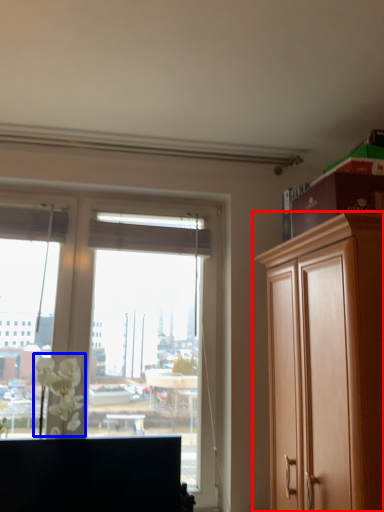
Question: Which of the following is the farthest to the observer, cabinetry (highlighted by a red box) or flower (highlighted by a blue box)?

Choices:
 (A) cabinetry
 (B) flower

Answer: (B)